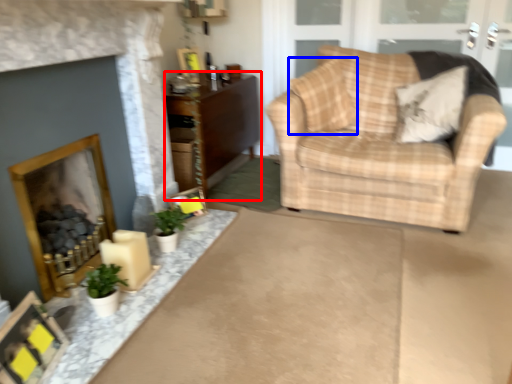
Question: Which object is closer to the camera taking this photo, cabinetry (highlighted by a red box) or pillow (highlighted by a blue box)?

Choices:
 (A) cabinetry
 (B) pillow

Answer: (B)